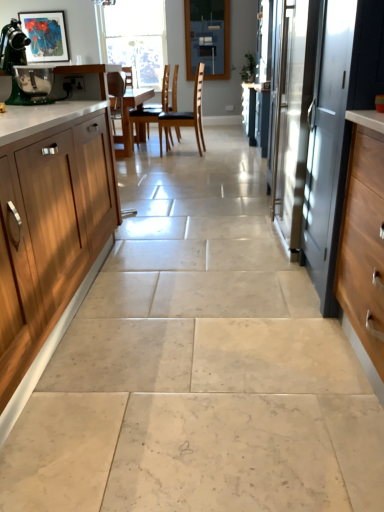
Image resolution: width=384 pixels, height=512 pixels. Identify the location of free space between satin silver screen door at right and wooden cabinet at left. pos(187,300).